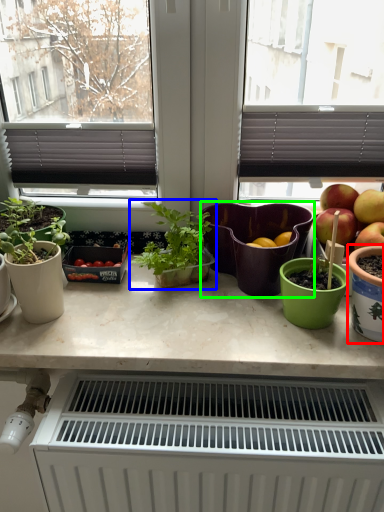
Question: Estimate the real-world distances between objects in this image. Which object is closer to flowerpot (highlighted by a red box), houseplant (highlighted by a blue box) or flowerpot (highlighted by a green box)?

Choices:
 (A) houseplant
 (B) flowerpot

Answer: (B)